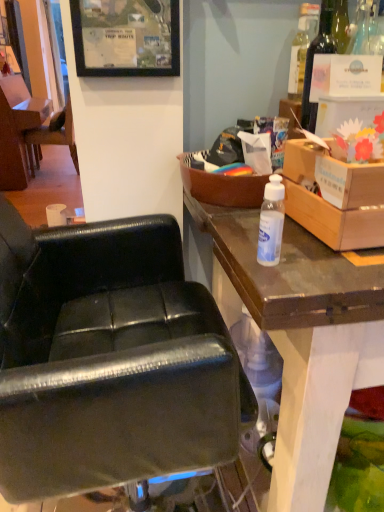
Question: Can you confirm if black matte picture frame at upper center is thinner than transparent plastic bottle at center, which ranks as the 1th bottle in left-to-right order?

Choices:
 (A) yes
 (B) no

Answer: (A)

Question: Is black matte picture frame at upper center positioned with its back to transparent plastic bottle at center, the second bottle viewed from the right?

Choices:
 (A) no
 (B) yes

Answer: (A)

Question: Is black matte picture frame at upper center at the left side of transparent plastic bottle at center, the 2th bottle positioned from the top?

Choices:
 (A) no
 (B) yes

Answer: (B)

Question: From a real-world perspective, is black matte picture frame at upper center on top of transparent plastic bottle at center, which is counted as the second bottle, starting from the back?

Choices:
 (A) yes
 (B) no

Answer: (A)

Question: Considering the relative sizes of black matte picture frame at upper center and transparent plastic bottle at center, which is the 1th bottle from bottom to top, in the image provided, is black matte picture frame at upper center smaller than transparent plastic bottle at center, which is the 1th bottle from bottom to top,?

Choices:
 (A) no
 (B) yes

Answer: (A)

Question: Based on their sizes in the image, would you say black leather chair at left, which is the second chair in right-to-left order, is bigger or smaller than brown wooden box at upper right, which is the first box in left-to-right order?

Choices:
 (A) small
 (B) big

Answer: (B)

Question: From the image's perspective, relative to brown wooden box at upper right, which is the 2th box in right-to-left order, is black leather chair at left, which appears as the first chair when viewed from the left, above or below?

Choices:
 (A) above
 (B) below

Answer: (A)

Question: Based on their positions, is black leather chair at left, the first chair when ordered from top to bottom, located to the left or right of brown wooden box at upper right, which is the 2th box in right-to-left order?

Choices:
 (A) left
 (B) right

Answer: (A)

Question: In the image, is black leather chair at left, the second chair when ordered from front to back, positioned in front of or behind brown wooden box at upper right, which is the 2th box in right-to-left order?

Choices:
 (A) front
 (B) behind

Answer: (B)

Question: From the image's perspective, relative to black matte picture frame at upper center, is transparent plastic bottle at center, which is counted as the second bottle, starting from the back, above or below?

Choices:
 (A) below
 (B) above

Answer: (A)

Question: Is point (261, 232) closer or farther from the camera than point (129, 74)?

Choices:
 (A) closer
 (B) farther

Answer: (A)

Question: Considering the relative positions of transparent plastic bottle at center, which is the 1th bottle from bottom to top, and black matte picture frame at upper center in the image provided, is transparent plastic bottle at center, which is the 1th bottle from bottom to top, to the left or to the right of black matte picture frame at upper center?

Choices:
 (A) right
 (B) left

Answer: (A)

Question: Is transparent plastic bottle at center, the 2th bottle positioned from the top, taller or shorter than black matte picture frame at upper center?

Choices:
 (A) short
 (B) tall

Answer: (A)

Question: Considering the positions of black leather chair at center, positioned as the 1th chair in front-to-back order, and cardboard box at upper right, the second box from the left, in the image, is black leather chair at center, positioned as the 1th chair in front-to-back order, wider or thinner than cardboard box at upper right, the second box from the left,?

Choices:
 (A) wide
 (B) thin

Answer: (A)

Question: Based on their sizes in the image, would you say black leather chair at center, arranged as the second chair when viewed from the left, is bigger or smaller than cardboard box at upper right, the second box from the left?

Choices:
 (A) small
 (B) big

Answer: (B)